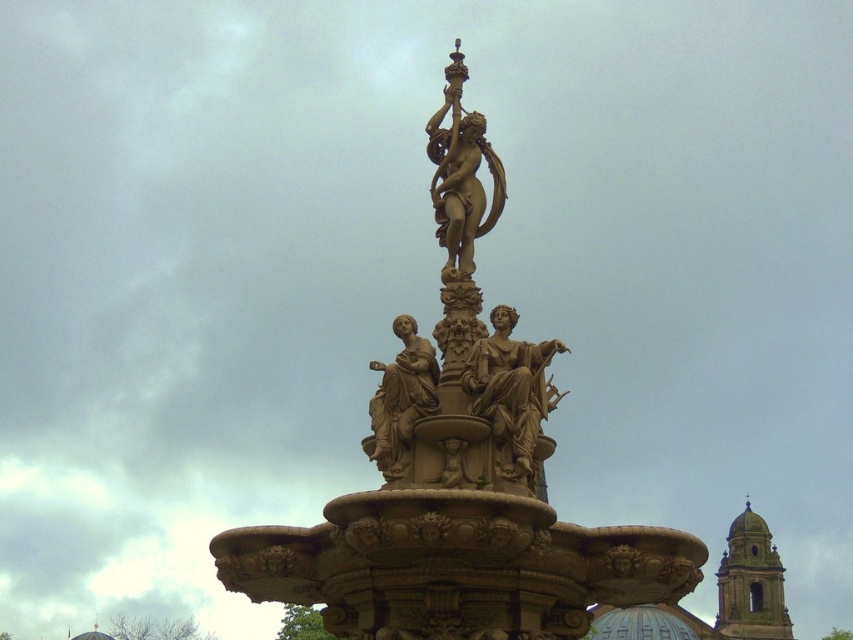
You are an art student observing the fountain sculpture. You notice two statues at the center. Which one is closer to you, the bronze statue at center or the gold polished statue at center?

The bronze statue at center is closer to you because it is in front of the gold polished statue at center.

You are a photographer taking a picture of the fountain. You want to focus on the statue at point (529, 400) and the statue at point (395, 428). Which statue should you adjust your camera focus first to ensure both are in sharp focus?

You should focus on the statue at point (529, 400) first because it is closer to the camera than the statue at point (395, 428). By focusing on the closer object, the farther one will also be in focus due to the depth of field.